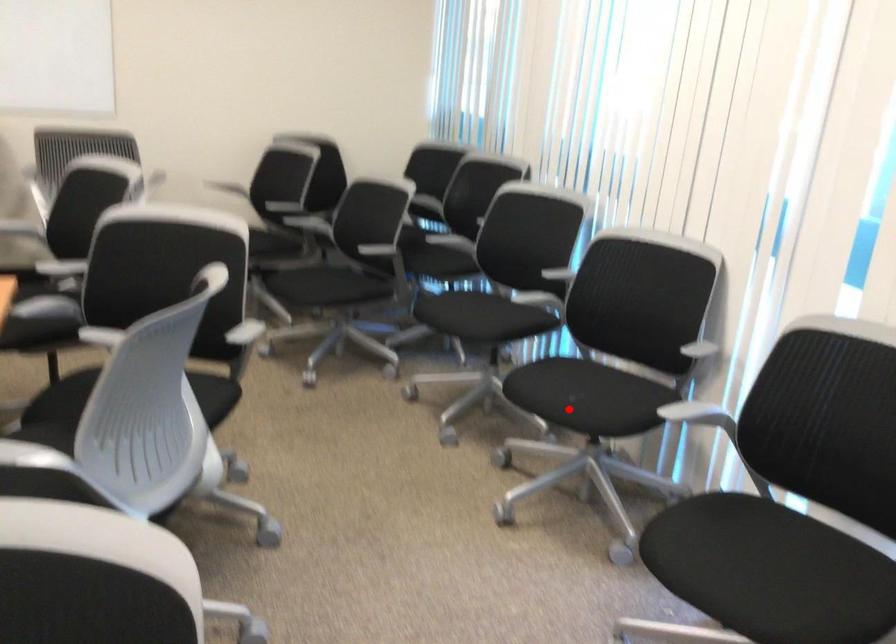
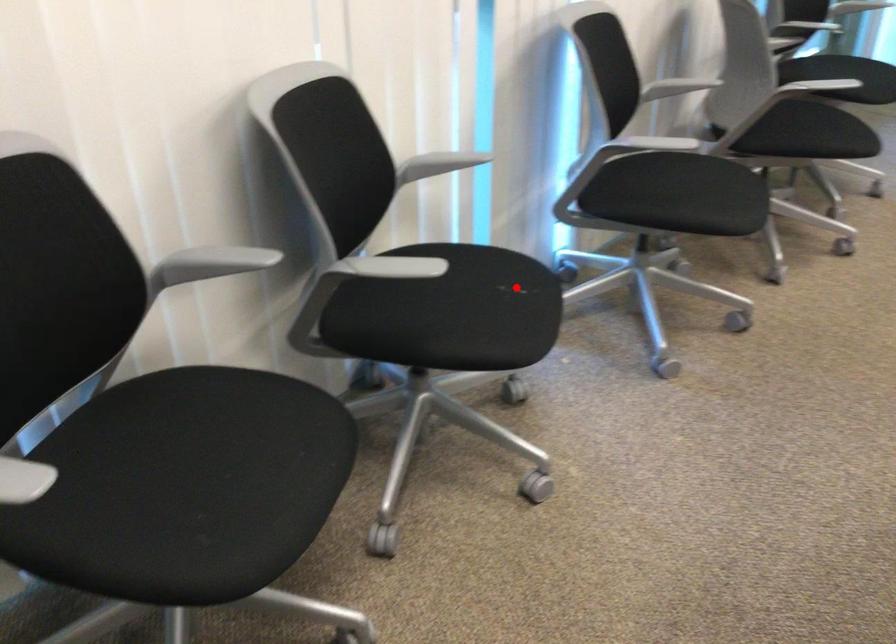
I am providing you with two images of the same scene from different viewpoints. A red point is marked on the first image and another point is marked on the second image. Is the marked point in image1 the same physical position as the marked point in image2?

Yes